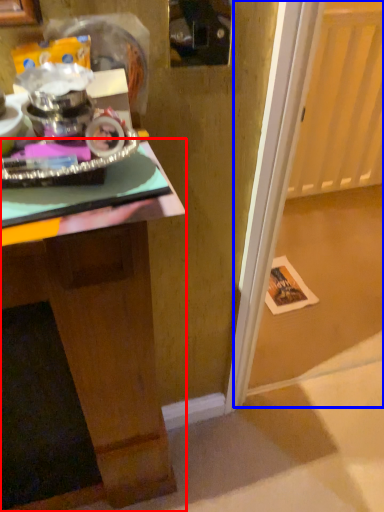
Question: Which object is further to the camera taking this photo, desk (highlighted by a red box) or glass door (highlighted by a blue box)?

Choices:
 (A) desk
 (B) glass door

Answer: (B)